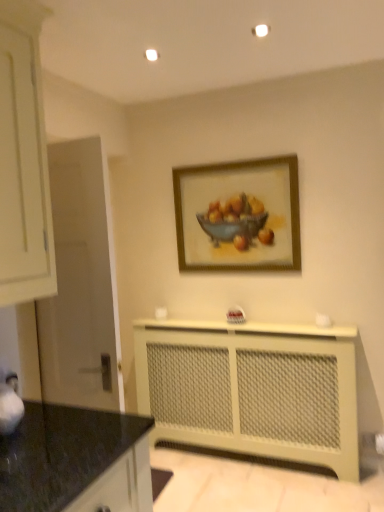
Question: Considering their positions, is wooden frame at upper center located in front of or behind black granite countertop at lower left?

Choices:
 (A) front
 (B) behind

Answer: (B)

Question: Is wooden frame at upper center situated inside black granite countertop at lower left or outside?

Choices:
 (A) outside
 (B) inside

Answer: (A)

Question: Which object is the farthest from the wooden frame at upper center?

Choices:
 (A) beige mesh radiator at lower center
 (B) black granite countertop at lower left

Answer: (B)

Question: Which of these objects is positioned closest to the wooden frame at upper center?

Choices:
 (A) black granite countertop at lower left
 (B) beige mesh radiator at lower center

Answer: (B)